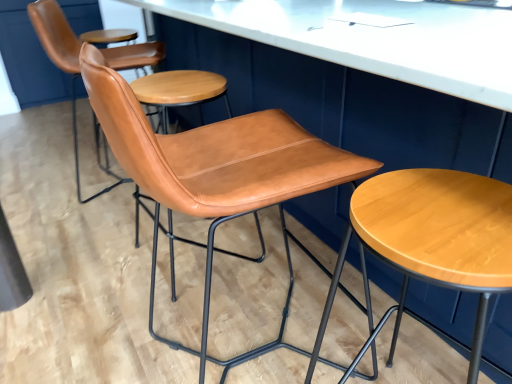
Locate an element on the screen. The height and width of the screenshot is (384, 512). free space between cognac leather chair at center, the second chair viewed from the front, and cognac leather chair at center, which is counted as the 3th chair, starting from the back is located at coordinates (196, 288).